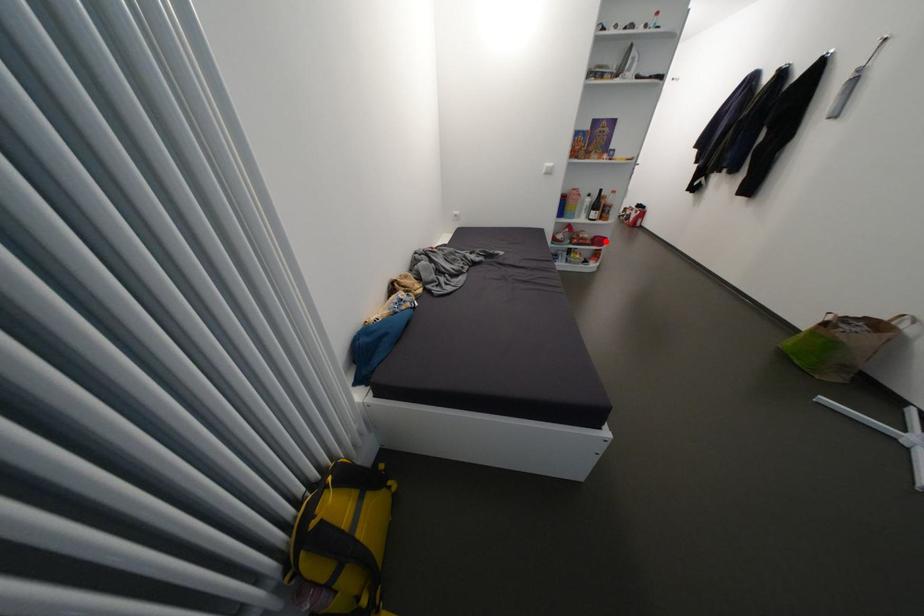
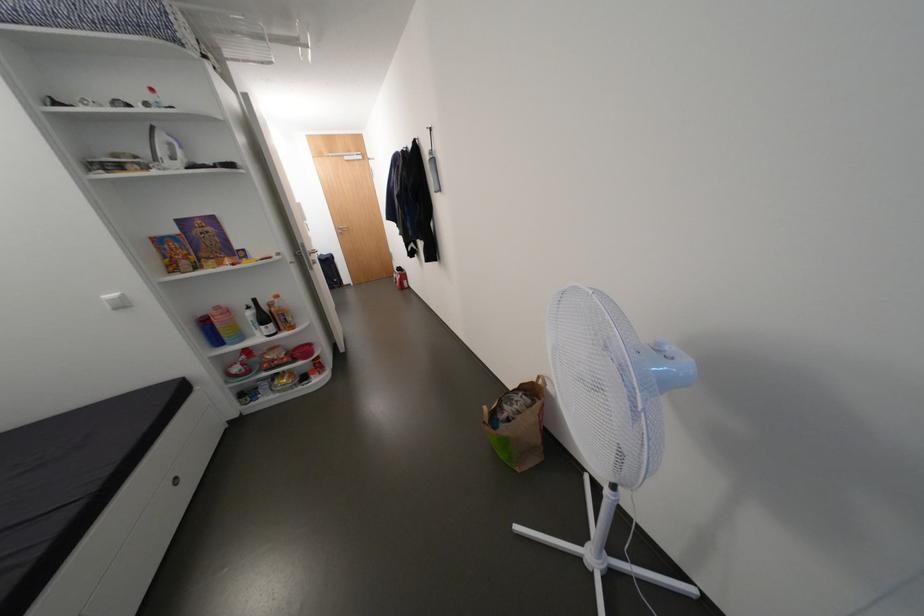
Question: I am providing you with two images of the same scene from different viewpoints. A red point is shown in image1. For the corresponding object point in image2, is it positioned nearer or farther from the camera?

Choices:
 (A) Nearer
 (B) Farther

Answer: (A)